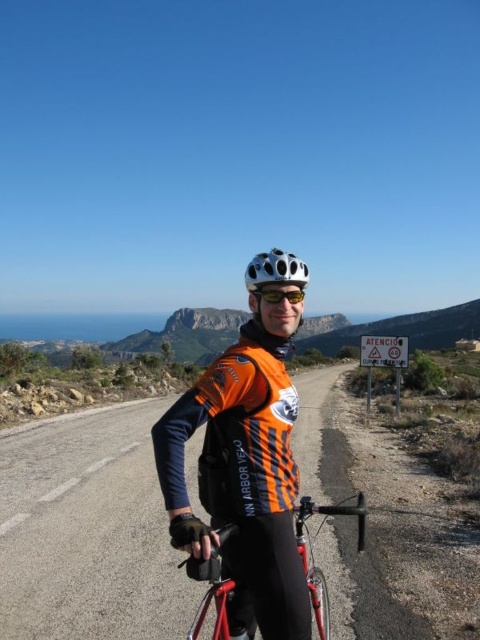
Question: Is shiny red bicycle at center positioned before white matte helmet at center?

Choices:
 (A) no
 (B) yes

Answer: (B)

Question: Can you confirm if shiny red bicycle at center is positioned below white matte bicycle helmet at center?

Choices:
 (A) yes
 (B) no

Answer: (A)

Question: Which of these objects is positioned closest to the shiny orange cycling jersey at center?

Choices:
 (A) shiny red bicycle at center
 (B) white matte bicycle helmet at center
 (C) reflective plastic goggles at center

Answer: (C)

Question: Is shiny orange cycling jersey at center further to camera compared to shiny red bicycle at center?

Choices:
 (A) no
 (B) yes

Answer: (A)

Question: Which object is closer to the camera taking this photo?

Choices:
 (A) shiny orange cycling jersey at center
 (B) shiny red bicycle at center

Answer: (A)

Question: Which object is closer to the camera taking this photo?

Choices:
 (A) reflective plastic goggles at center
 (B) white matte helmet at center

Answer: (A)